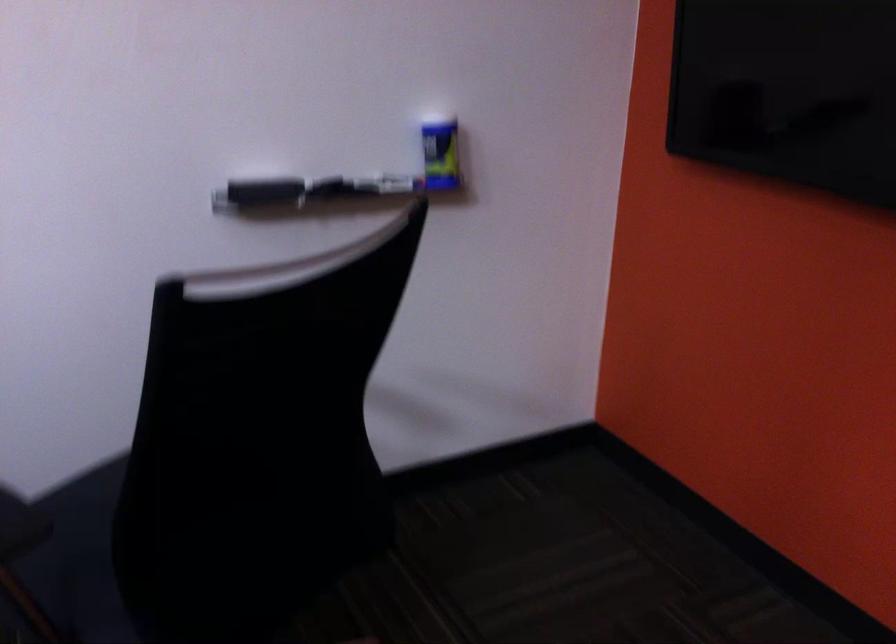
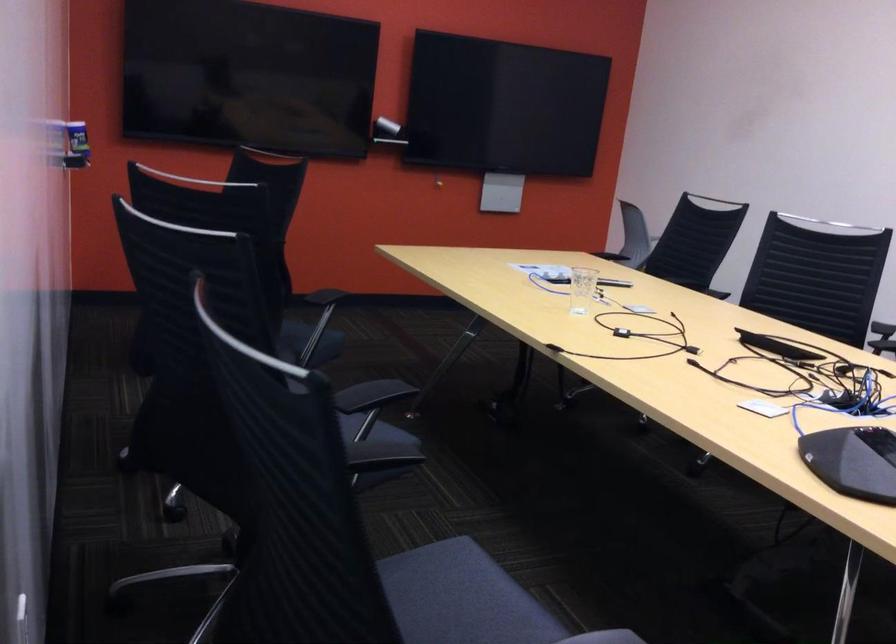
Question: I am providing you with two images of the same scene from different viewpoints. Which of the following objects are not visible in image2?

Choices:
 (A) red container handle
 (B) black chair sitting surface
 (C) black conference phone
 (D) blue and yellow can

Answer: (D)